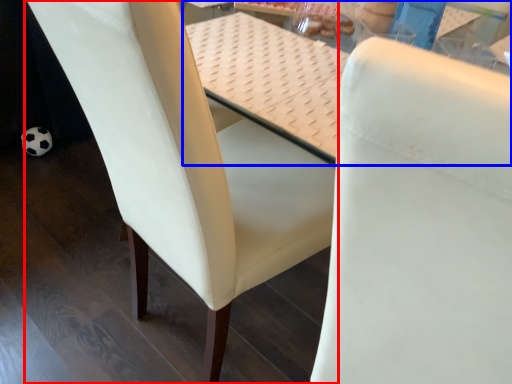
Question: Which object is closer to the camera taking this photo, chair (highlighted by a red box) or table (highlighted by a blue box)?

Choices:
 (A) chair
 (B) table

Answer: (A)